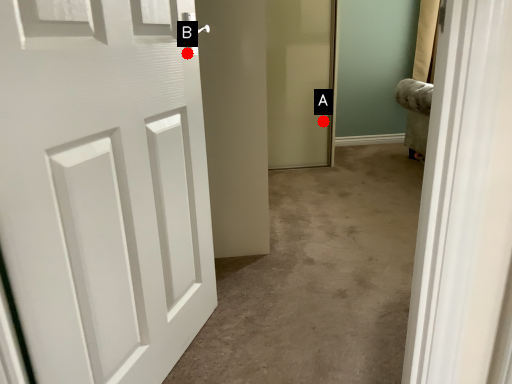
Question: Two points are circled on the image, labeled by A and B beside each circle. Which point appears farthest from the camera in this image?

Choices:
 (A) A is further
 (B) B is further

Answer: (A)